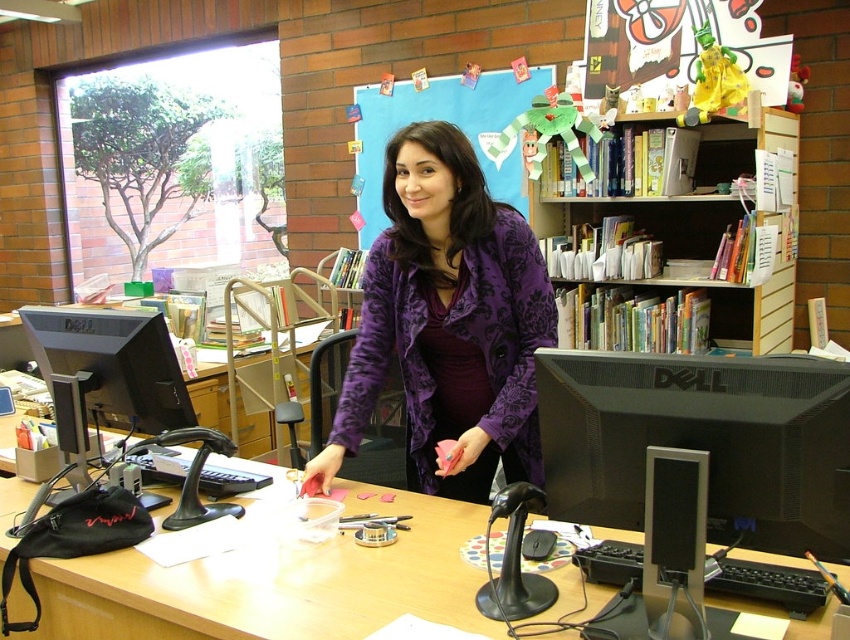
Describe the element at coordinates (276, 584) in the screenshot. I see `wooden at center` at that location.

Identify the location of wooden at center. The height and width of the screenshot is (640, 850). (276, 584).

Who is positioned more to the left, purple velvet jacket at center or multicolored paper books at upper right?

From the viewer's perspective, purple velvet jacket at center appears more on the left side.

Does purple velvet jacket at center have a greater width compared to multicolored paper books at upper right?

In fact, purple velvet jacket at center might be narrower than multicolored paper books at upper right.

Based on the photo, measure the distance between purple velvet jacket at center and camera.

purple velvet jacket at center is 1.65 meters from camera.

Where is `purple velvet jacket at center`? The width and height of the screenshot is (850, 640). purple velvet jacket at center is located at coordinates (448, 323).

Who is more forward, (740, 465) or (771, 168)?

Point (740, 465) is more forward.

Does black matte monitor at center have a greater width compared to multicolored paper books at upper right?

No.

Where is `black matte monitor at center`? black matte monitor at center is located at coordinates (701, 442).